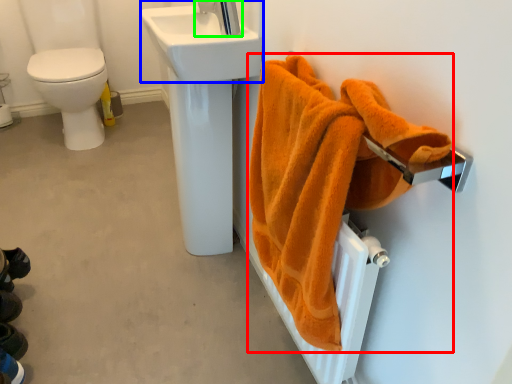
Question: Which is nearer to the towel (highlighted by a red box)? sink (highlighted by a blue box) or tap (highlighted by a green box).

Choices:
 (A) sink
 (B) tap

Answer: (A)